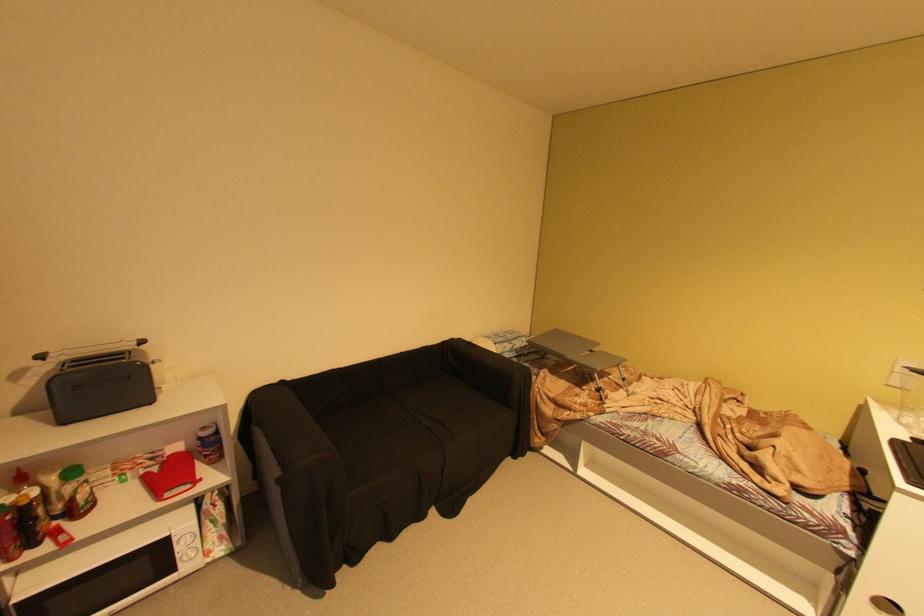
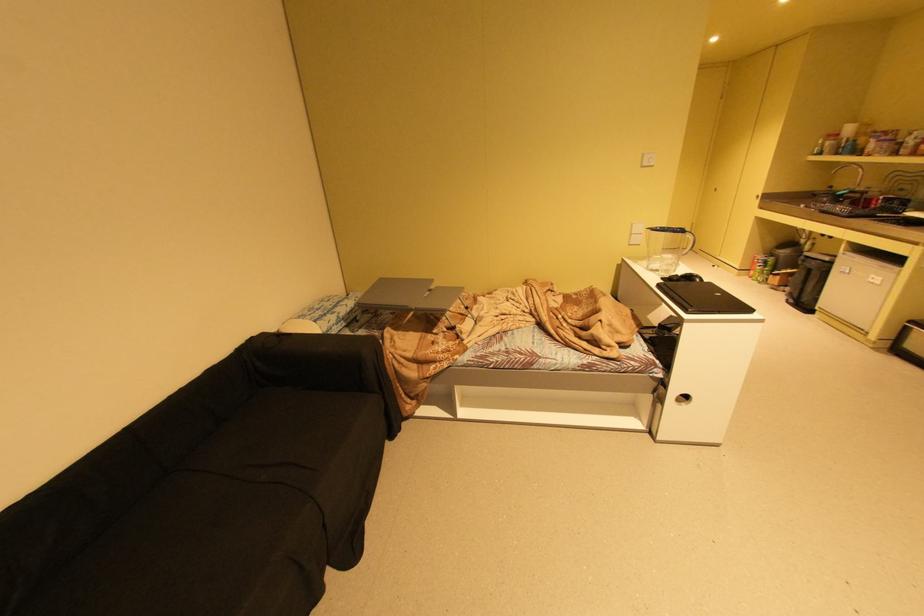
Where in the second image is the point corresponding to the point at 464,338 from the first image?

(262, 334)